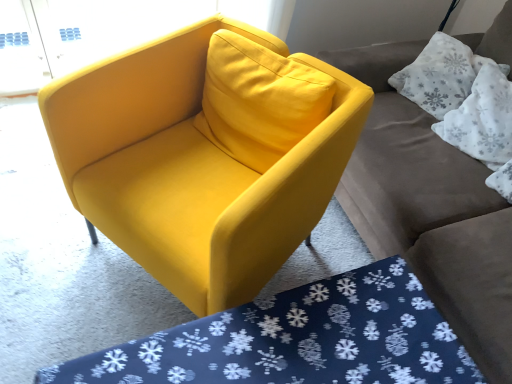
Question: Is white textured pillow at upper right, acting as the first pillow starting from the top, positioned with its back to matte yellow armchair at center?

Choices:
 (A) no
 (B) yes

Answer: (A)

Question: Can you confirm if white textured pillow at upper right, the 2th pillow positioned from the bottom, is positioned to the left of matte yellow armchair at center?

Choices:
 (A) yes
 (B) no

Answer: (B)

Question: Is white textured pillow at upper right, acting as the first pillow starting from the top, facing towards matte yellow armchair at center?

Choices:
 (A) no
 (B) yes

Answer: (B)

Question: Would you say white textured pillow at upper right, the 2th pillow positioned from the bottom, is outside matte yellow armchair at center?

Choices:
 (A) no
 (B) yes

Answer: (B)

Question: Is white textured pillow at upper right, acting as the first pillow starting from the top, positioned before matte yellow armchair at center?

Choices:
 (A) no
 (B) yes

Answer: (A)

Question: Considering the positions of blue snowflake-patterned mat at lower center and matte gray couch at upper right in the image, is blue snowflake-patterned mat at lower center taller or shorter than matte gray couch at upper right?

Choices:
 (A) short
 (B) tall

Answer: (A)

Question: In terms of size, does blue snowflake-patterned mat at lower center appear bigger or smaller than matte gray couch at upper right?

Choices:
 (A) big
 (B) small

Answer: (B)

Question: Looking at their shapes, would you say blue snowflake-patterned mat at lower center is wider or thinner than matte gray couch at upper right?

Choices:
 (A) wide
 (B) thin

Answer: (A)

Question: Choose the correct answer: Is blue snowflake-patterned mat at lower center inside matte gray couch at upper right or outside it?

Choices:
 (A) inside
 (B) outside

Answer: (B)

Question: Considering the positions of point (471, 150) and point (472, 59), is point (471, 150) closer or farther from the camera than point (472, 59)?

Choices:
 (A) farther
 (B) closer

Answer: (B)

Question: From the image's perspective, is white fabric pillow at upper right, the first pillow in the bottom-to-top sequence, above or below white textured pillow at upper right, acting as the first pillow starting from the top?

Choices:
 (A) above
 (B) below

Answer: (B)

Question: Considering the positions of white fabric pillow at upper right, the first pillow in the bottom-to-top sequence, and white textured pillow at upper right, the 2th pillow positioned from the bottom, in the image, is white fabric pillow at upper right, the first pillow in the bottom-to-top sequence, wider or thinner than white textured pillow at upper right, the 2th pillow positioned from the bottom,?

Choices:
 (A) wide
 (B) thin

Answer: (B)

Question: From a real-world perspective, relative to white textured pillow at upper right, acting as the first pillow starting from the top, is white fabric pillow at upper right, the first pillow in the bottom-to-top sequence, vertically above or below?

Choices:
 (A) above
 (B) below

Answer: (A)

Question: From a real-world perspective, is white fabric pillow at upper right, the first pillow in the bottom-to-top sequence, positioned above or below matte gray couch at upper right?

Choices:
 (A) below
 (B) above

Answer: (B)

Question: Visually, is white fabric pillow at upper right, the first pillow in the bottom-to-top sequence, positioned to the left or to the right of matte gray couch at upper right?

Choices:
 (A) left
 (B) right

Answer: (B)